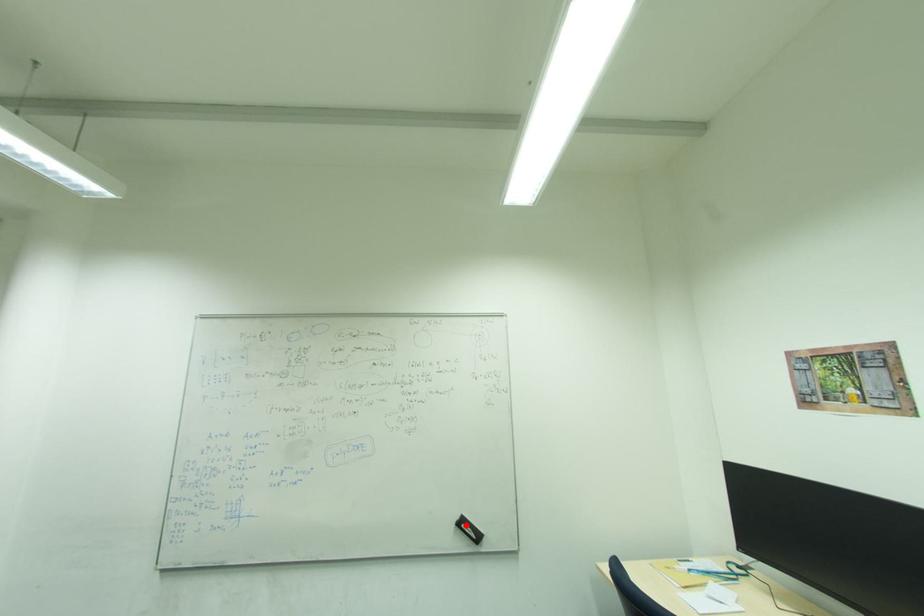
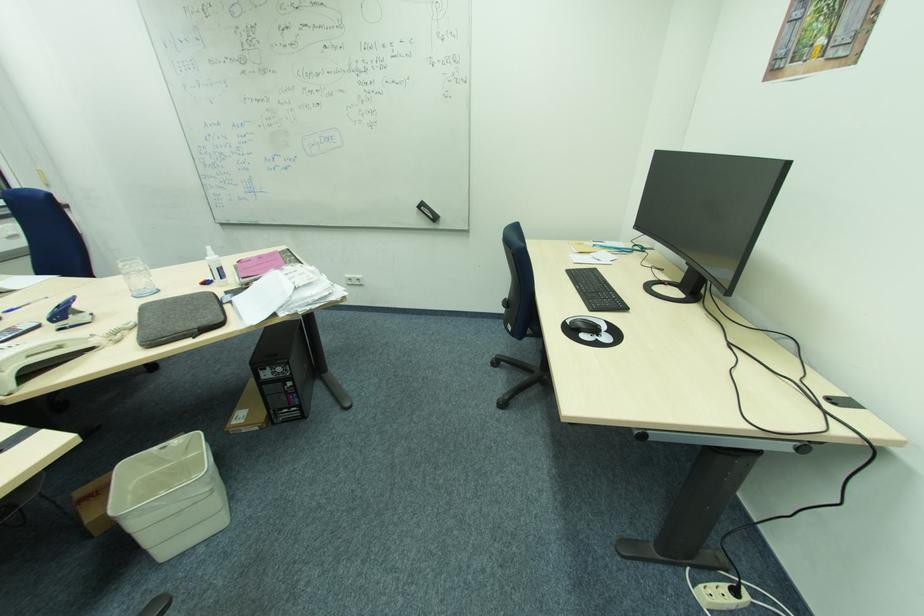
In the second image, find the point that corresponds to the highlighted location in the first image.

(426, 208)